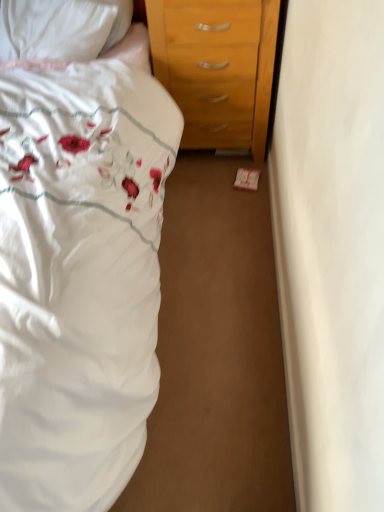
Question: Can you confirm if white floral fabric bed at left is wider than white satin pillow at upper left?

Choices:
 (A) yes
 (B) no

Answer: (A)

Question: Is white floral fabric bed at left to the left of white satin pillow at upper left from the viewer's perspective?

Choices:
 (A) no
 (B) yes

Answer: (B)

Question: Is white floral fabric bed at left not inside white satin pillow at upper left?

Choices:
 (A) yes
 (B) no

Answer: (A)

Question: Is white floral fabric bed at left smaller than white satin pillow at upper left?

Choices:
 (A) no
 (B) yes

Answer: (A)

Question: From the image's perspective, is white floral fabric bed at left beneath white satin pillow at upper left?

Choices:
 (A) no
 (B) yes

Answer: (B)

Question: Considering the relative sizes of white floral fabric bed at left and white satin pillow at upper left in the image provided, is white floral fabric bed at left shorter than white satin pillow at upper left?

Choices:
 (A) yes
 (B) no

Answer: (B)

Question: Is white satin pillow at upper left at the right side of white floral fabric bed at left?

Choices:
 (A) yes
 (B) no

Answer: (A)

Question: From the image's perspective, is white satin pillow at upper left over white floral fabric bed at left?

Choices:
 (A) yes
 (B) no

Answer: (A)

Question: Considering the relative positions of white satin pillow at upper left and white floral fabric bed at left in the image provided, is white satin pillow at upper left behind white floral fabric bed at left?

Choices:
 (A) no
 (B) yes

Answer: (B)

Question: From the image's perspective, is white satin pillow at upper left beneath white floral fabric bed at left?

Choices:
 (A) yes
 (B) no

Answer: (B)

Question: Is white satin pillow at upper left thinner than white floral fabric bed at left?

Choices:
 (A) no
 (B) yes

Answer: (B)

Question: Is white satin pillow at upper left facing away from white floral fabric bed at left?

Choices:
 (A) yes
 (B) no

Answer: (A)

Question: From the image's perspective, relative to white satin pillow at upper left, is white floral fabric bed at left above or below?

Choices:
 (A) below
 (B) above

Answer: (A)